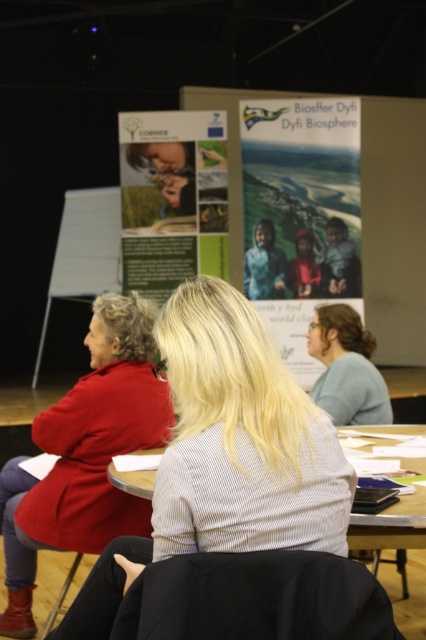
This screenshot has width=426, height=640. I want to click on matte paper poster at center, so click(299, 214).

Is point (291, 317) positioned before point (169, 120)?

No, it is not.

Find the location of `matte paper poster at center`. matte paper poster at center is located at coordinates (299, 214).

Where is `matte paper poster at center`? matte paper poster at center is located at coordinates [x=299, y=214].

This screenshot has height=640, width=426. Describe the element at coordinates (86, 452) in the screenshot. I see `matte red coat at left` at that location.

Does point (161, 396) come farther from viewer compared to point (66, 593)?

No, (161, 396) is closer to viewer.

Is point (11, 524) behind point (408, 545)?

Yes, point (11, 524) is behind point (408, 545).

I want to click on matte red coat at left, so click(x=86, y=452).

Can you confirm if light blue fabric shirt at center is shorter than wooden table at center?

Incorrect, light blue fabric shirt at center's height does not fall short of wooden table at center's.

Is light blue fabric shirt at center further to the viewer compared to wooden table at center?

That is True.

The image size is (426, 640). What do you see at coordinates (347, 368) in the screenshot? I see `light blue fabric shirt at center` at bounding box center [347, 368].

The height and width of the screenshot is (640, 426). I want to click on light blue fabric shirt at center, so click(x=347, y=368).